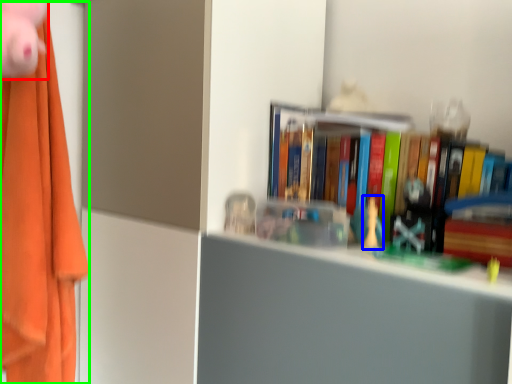
Question: Estimate the real-world distances between objects in this image. Which object is farther from toy (highlighted by a red box), toy (highlighted by a blue box) or clothe (highlighted by a green box)?

Choices:
 (A) toy
 (B) clothe

Answer: (B)